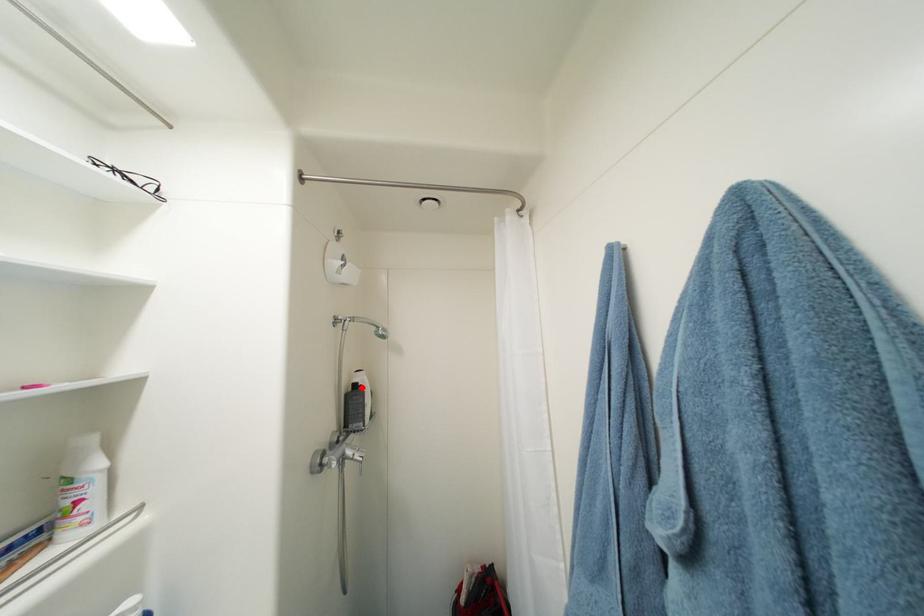
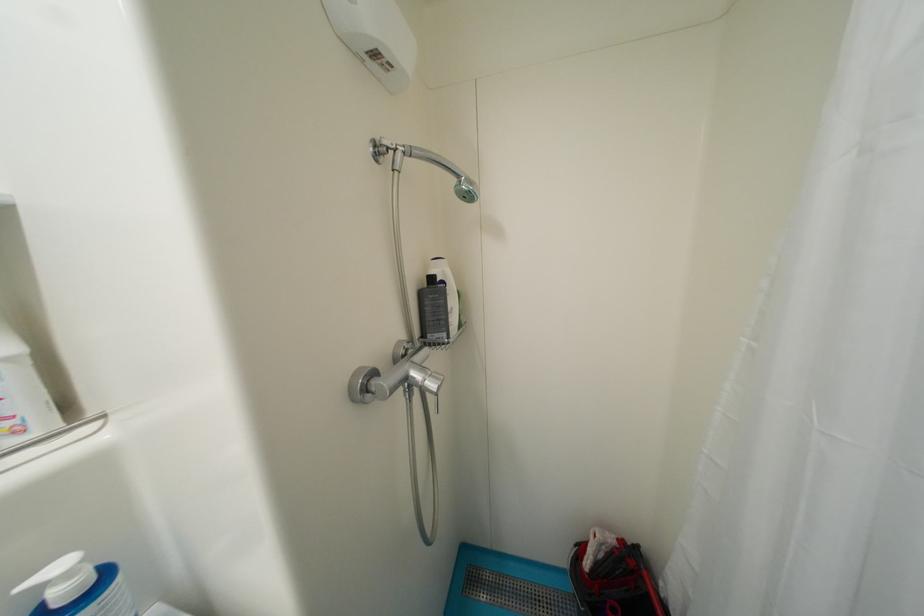
The point at the highlighted location is marked in the first image. Where is the corresponding point in the second image?

(439, 281)